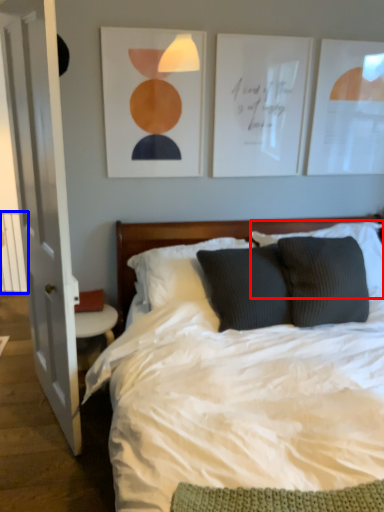
Question: Which point is further to the camera, pillow (highlighted by a red box) or balustrade (highlighted by a blue box)?

Choices:
 (A) pillow
 (B) balustrade

Answer: (B)